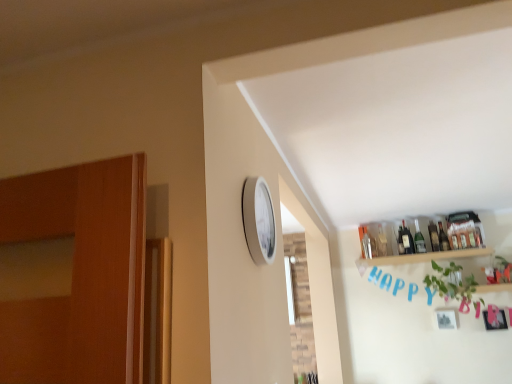
Question: From the image's perspective, does green glass bottle at upper right, the 2th bottle when ordered from left to right, appear lower than translucent glass bottle at upper right, marked as the first bottle in a right-to-left arrangement?

Choices:
 (A) yes
 (B) no

Answer: (A)

Question: Can you confirm if green glass bottle at upper right, the 2th bottle when ordered from left to right, is positioned to the left of translucent glass bottle at upper right, marked as the first bottle in a right-to-left arrangement?

Choices:
 (A) no
 (B) yes

Answer: (B)

Question: Is green glass bottle at upper right, the 3th bottle positioned from the right, thinner than translucent glass bottle at upper right, which is counted as the fourth bottle, starting from the left?

Choices:
 (A) yes
 (B) no

Answer: (A)

Question: From a real-world perspective, is green glass bottle at upper right, the 2th bottle when ordered from left to right, over translucent glass bottle at upper right, marked as the first bottle in a right-to-left arrangement?

Choices:
 (A) no
 (B) yes

Answer: (B)

Question: Is translucent glass bottle at upper right, which is counted as the fourth bottle, starting from the left, inside green glass bottle at upper right, the 2th bottle when ordered from left to right?

Choices:
 (A) yes
 (B) no

Answer: (B)

Question: Could you tell me if green glass bottle at upper right, the 2th bottle when ordered from left to right, is facing translucent glass bottle at upper right, which is counted as the fourth bottle, starting from the left?

Choices:
 (A) yes
 (B) no

Answer: (B)

Question: Is white plastic clock at upper center shorter than green glass bottle at upper right, the 2th bottle when ordered from left to right?

Choices:
 (A) yes
 (B) no

Answer: (A)

Question: Is white plastic clock at upper center placed right next to green glass bottle at upper right, the 3th bottle positioned from the right?

Choices:
 (A) no
 (B) yes

Answer: (A)

Question: Considering the relative sizes of white plastic clock at upper center and green glass bottle at upper right, the 3th bottle positioned from the right, in the image provided, is white plastic clock at upper center taller than green glass bottle at upper right, the 3th bottle positioned from the right,?

Choices:
 (A) no
 (B) yes

Answer: (A)

Question: Can you confirm if white plastic clock at upper center is bigger than green glass bottle at upper right, the 3th bottle positioned from the right?

Choices:
 (A) no
 (B) yes

Answer: (B)

Question: From a real-world perspective, does white plastic clock at upper center stand above green glass bottle at upper right, the 2th bottle when ordered from left to right?

Choices:
 (A) yes
 (B) no

Answer: (B)

Question: From the image's perspective, is white plastic clock at upper center on green glass bottle at upper right, the 2th bottle when ordered from left to right?

Choices:
 (A) yes
 (B) no

Answer: (A)

Question: Is translucent glass bottle at upper right, the 1th bottle in the left-to-right sequence, positioned with its back to green leafy plant at upper right?

Choices:
 (A) no
 (B) yes

Answer: (A)